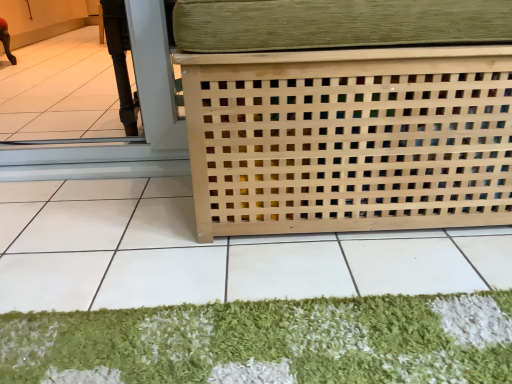
Where is `free space to the left of natural wood lattice at center`? free space to the left of natural wood lattice at center is located at coordinates (111, 232).